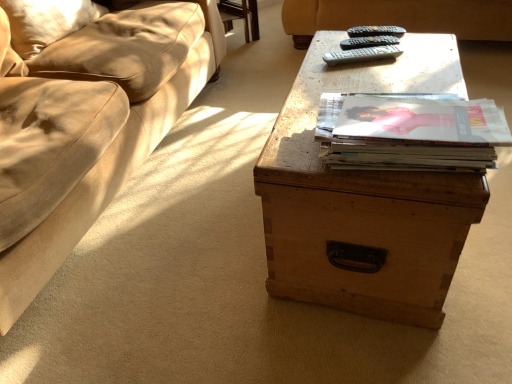
This screenshot has width=512, height=384. I want to click on free point behind matte paper stack of magazines at center, so click(375, 77).